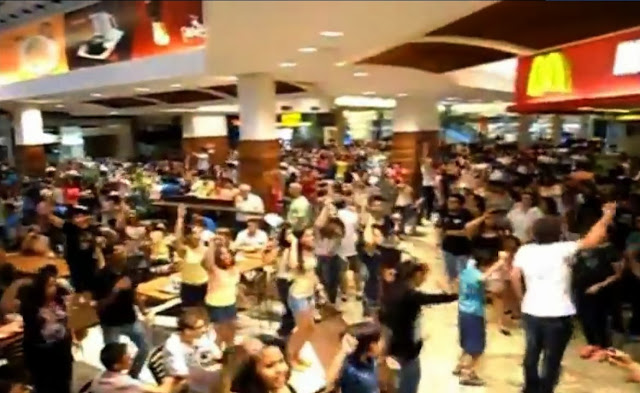
Image resolution: width=640 pixels, height=393 pixels. Find the location of `structural pillar`. structural pillar is located at coordinates (29, 148).